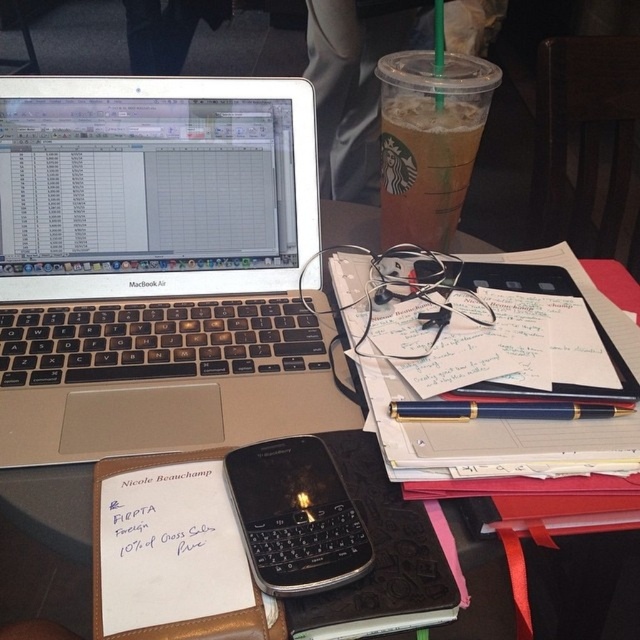
Question: Which of the following is the closest to the observer?

Choices:
 (A) (358, 480)
 (B) (42, 620)

Answer: (A)

Question: Estimate the real-world distances between objects in this image. Which object is closer to the black plastic phone at center?

Choices:
 (A) silver metallic laptop at upper left
 (B) translucent plastic cup at upper center
 (C) black leather notebook at center

Answer: (C)

Question: Which point is closer to the camera taking this photo?

Choices:
 (A) (129, 216)
 (B) (419, 198)
 (C) (147, 529)

Answer: (C)

Question: Observing the image, what is the correct spatial positioning of translucent plastic cup at upper center in reference to blue metallic pen at center?

Choices:
 (A) above
 (B) below

Answer: (A)

Question: Can you confirm if silver metallic laptop at upper left is positioned to the right of black leather notebook at center?

Choices:
 (A) no
 (B) yes

Answer: (A)

Question: Is the position of silver metallic laptop at upper left less distant than that of white paper at center?

Choices:
 (A) yes
 (B) no

Answer: (B)